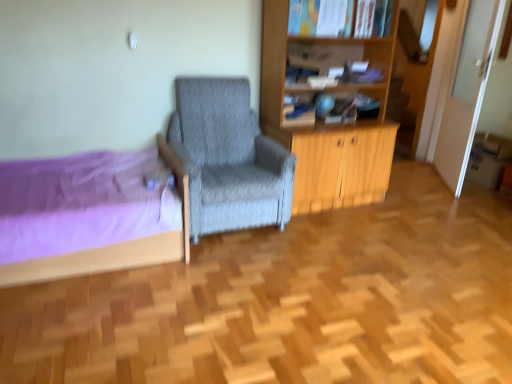
This screenshot has width=512, height=384. I want to click on free space in front of gray fabric chair at center, so click(245, 274).